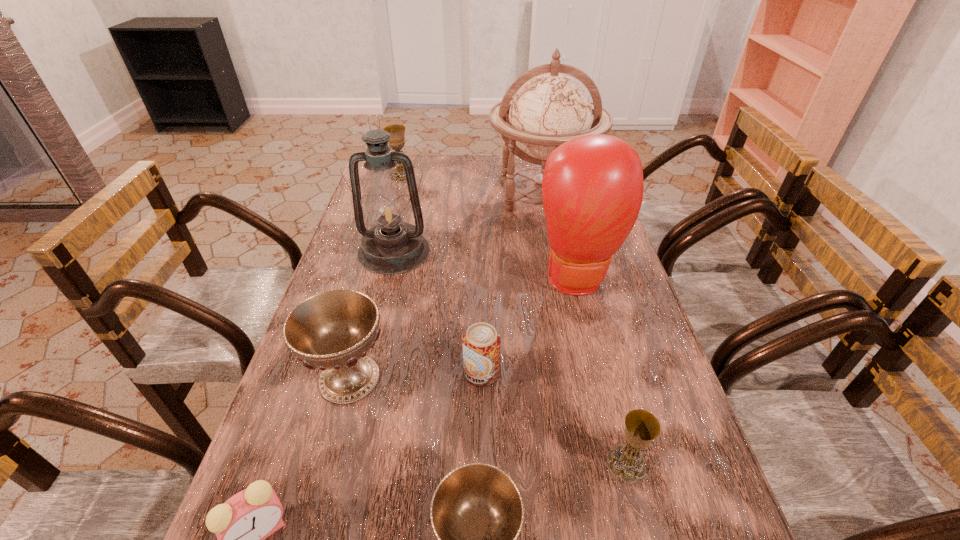
At what (x,y) coordinates should I click in order to perform the action: click on free space between the globe and the oil lamp. Please return your answer as a coordinate pair (x, y). Image resolution: width=960 pixels, height=540 pixels. Looking at the image, I should click on (468, 221).

This screenshot has height=540, width=960. Find the location of `free space between the boxing glove and the bigger red chalice`. free space between the boxing glove and the bigger red chalice is located at coordinates (464, 328).

Select which object appears as the fifth closest to the beer can. Please provide its 2D coordinates. Your answer should be formatted as a tuple, i.e. [(x, y)], where the tuple contains the x and y coordinates of a point satisfying the conditions above.

[(391, 247)]

Select which object is the fourth closest to the pink alarm clock. Please provide its 2D coordinates. Your answer should be formatted as a tuple, i.e. [(x, y)], where the tuple contains the x and y coordinates of a point satisfying the conditions above.

[(641, 427)]

Where is `chalice that is the third nearest to the alarm clock`? chalice that is the third nearest to the alarm clock is located at coordinates (641, 427).

This screenshot has width=960, height=540. Find the location of `chalice that is the closest to the globe`. chalice that is the closest to the globe is located at coordinates (397, 132).

You are a GUI agent. You are given a task and a screenshot of the screen. Output one action in this format:
    pyautogui.click(x=<x>, y=<y>)
    Task: Click on the blank space that satisfies the following two spatial constraints: 1. on the front side of the left gold chalice; 2. on the left side of the left red chalice
    The width and height of the screenshot is (960, 540).
    Given the screenshot: What is the action you would take?
    pyautogui.click(x=345, y=378)